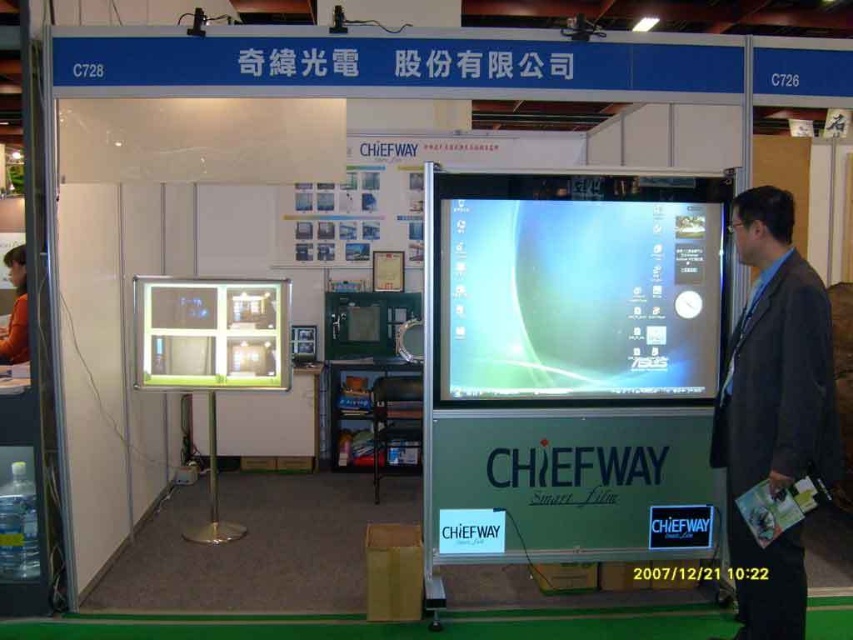
Question: Does matte glass monitor at center appear on the right side of matte glass display at center?

Choices:
 (A) no
 (B) yes

Answer: (B)

Question: Based on their relative distances, which object is nearer to the matte glass display at center?

Choices:
 (A) matte glass monitor at center
 (B) dark gray suit at right

Answer: (A)

Question: Which point is closer to the camera taking this photo?

Choices:
 (A) (772, 275)
 (B) (685, 250)
 (C) (254, 308)

Answer: (A)

Question: Which of the following is the closest to the observer?

Choices:
 (A) matte glass display at center
 (B) dark gray suit at right
 (C) matte glass monitor at center

Answer: (B)

Question: Does matte glass monitor at center appear on the left side of matte glass display at center?

Choices:
 (A) no
 (B) yes

Answer: (A)

Question: Can you confirm if dark gray suit at right is thinner than matte glass display at center?

Choices:
 (A) yes
 (B) no

Answer: (A)